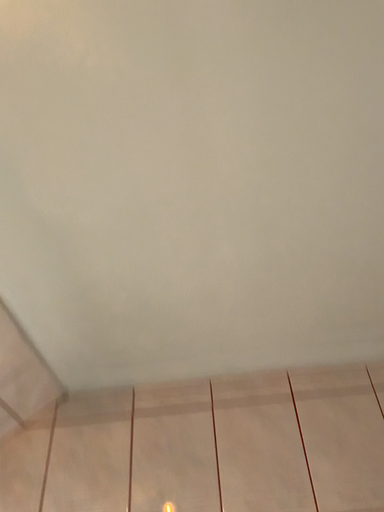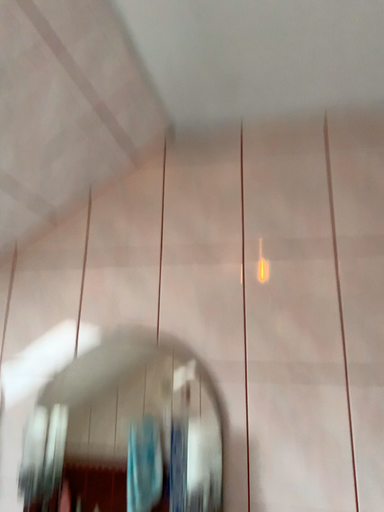
Question: Which way did the camera rotate in the video?

Choices:
 (A) rotated left
 (B) rotated right

Answer: (A)